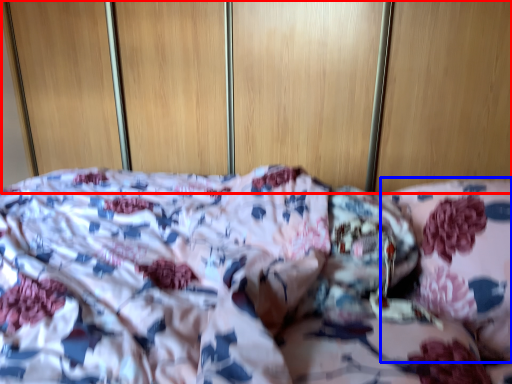
Question: Which point is further to the camera, dresser (highlighted by a red box) or pillow (highlighted by a blue box)?

Choices:
 (A) dresser
 (B) pillow

Answer: (A)